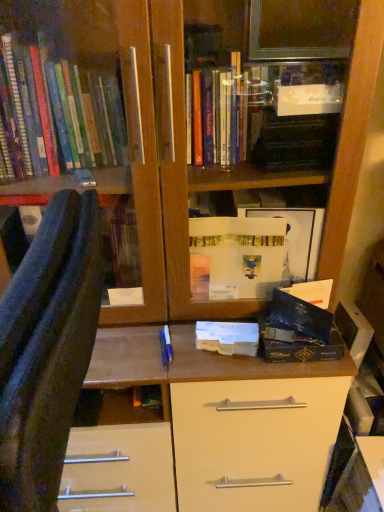
Where is `white matte paper at center`? The image size is (384, 512). white matte paper at center is located at coordinates (227, 337).

Measure the distance between white matte paper at center and camera.

They are 3.39 feet apart.

Measure the distance between point (249, 339) and camera.

They are 1.04 meters apart.

Image resolution: width=384 pixels, height=512 pixels. Describe the element at coordinates (227, 337) in the screenshot. I see `white matte paper at center` at that location.

The height and width of the screenshot is (512, 384). Describe the element at coordinates (47, 349) in the screenshot. I see `blue fabric chair at left` at that location.

The image size is (384, 512). Identify the location of blue fabric chair at left. (47, 349).

You are a GUI agent. You are given a task and a screenshot of the screen. Output one action in this format:
    pyautogui.click(x=<x>, y=<y>)
    Task: Click on the white matte paper at center
    The image size is (384, 512).
    Given the screenshot: What is the action you would take?
    pyautogui.click(x=227, y=337)

Does white matte paper at center appear on the left side of blue fabric chair at left?

Incorrect, white matte paper at center is not on the left side of blue fabric chair at left.

Is white matte paper at center positioned behind blue fabric chair at left?

Yes, white matte paper at center is behind blue fabric chair at left.

Is point (205, 333) closer or farther from the camera than point (66, 411)?

Point (205, 333).

From the image's perspective, which one is positioned higher, white matte paper at center or blue fabric chair at left?

white matte paper at center, from the image's perspective.

From a real-world perspective, which object rests below the other?

From a 3D spatial view, white matte paper at center is below.

Does white matte paper at center have a lesser width compared to blue fabric chair at left?

Yes.

Does white matte paper at center have a lesser height compared to blue fabric chair at left?

Correct, white matte paper at center is not as tall as blue fabric chair at left.

Considering the sizes of objects white matte paper at center and blue fabric chair at left in the image provided, who is smaller, white matte paper at center or blue fabric chair at left?

white matte paper at center.

Based on the photo, would you say blue fabric chair at left is part of white matte paper at center's contents?

No, blue fabric chair at left is not inside white matte paper at center.

Would you say white matte paper at center is a long distance from blue fabric chair at left?

No.

Could you tell me if white matte paper at center is turned towards blue fabric chair at left?

No.

How many degrees apart are the facing directions of white matte paper at center and blue fabric chair at left?

The facing directions of white matte paper at center and blue fabric chair at left are 81.9 degrees apart.

At what (x,y) coordinates should I click in order to perform the action: click on furniture located above the white matte paper at center (from a real-world perspective). Please return your answer as a coordinate pair (x, y). The width and height of the screenshot is (384, 512). Looking at the image, I should click on (47, 349).

Visually, is blue fabric chair at left positioned to the left or to the right of white matte paper at center?

blue fabric chair at left is to the left of white matte paper at center.

Is blue fabric chair at left in front of or behind white matte paper at center in the image?

Clearly, blue fabric chair at left is in front of white matte paper at center.

Between point (7, 410) and point (253, 332), which one is positioned behind?

The point (253, 332) is behind.

From the image's perspective, does blue fabric chair at left appear lower than white matte paper at center?

Yes, from the image's perspective, blue fabric chair at left is beneath white matte paper at center.

From a real-world perspective, which object stands above the other?

In real-world perspective, blue fabric chair at left is above.

Considering the sizes of objects blue fabric chair at left and white matte paper at center in the image provided, who is wider, blue fabric chair at left or white matte paper at center?

Wider between the two is blue fabric chair at left.

Can you confirm if blue fabric chair at left is taller than white matte paper at center?

Indeed, blue fabric chair at left has a greater height compared to white matte paper at center.

Considering the relative sizes of blue fabric chair at left and white matte paper at center in the image provided, is blue fabric chair at left smaller than white matte paper at center?

Actually, blue fabric chair at left might be larger than white matte paper at center.

Based on the photo, choose the correct answer: Is blue fabric chair at left inside white matte paper at center or outside it?

blue fabric chair at left is spatially situated outside white matte paper at center.

Is blue fabric chair at left positioned far away from white matte paper at center?

That's not correct — blue fabric chair at left is a little close to white matte paper at center.

Is blue fabric chair at left facing towards white matte paper at center?

No, blue fabric chair at left is not turned towards white matte paper at center.

How many degrees apart are the facing directions of blue fabric chair at left and white matte paper at center?

blue fabric chair at left and white matte paper at center are facing 81.9 degrees away from each other.

This screenshot has width=384, height=512. I want to click on paperback book located underneath the blue fabric chair at left (from a real-world perspective), so click(x=227, y=337).

You are a GUI agent. You are given a task and a screenshot of the screen. Output one action in this format:
    pyautogui.click(x=<x>, y=<y>)
    Task: Click on the furniture on the left of white matte paper at center
    
    Given the screenshot: What is the action you would take?
    pos(47,349)

The height and width of the screenshot is (512, 384). There is a white matte paper at center. Find the location of `furniture above it (from a real-world perspective)`. furniture above it (from a real-world perspective) is located at coordinates (47, 349).